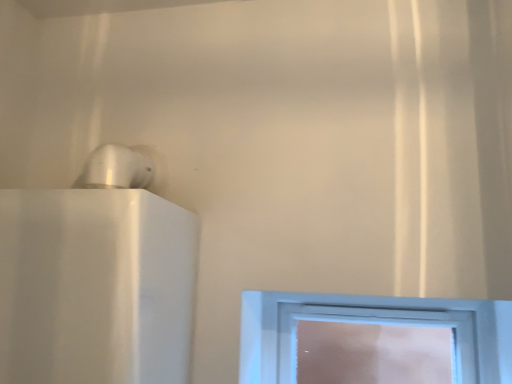
Question: From the image's perspective, is white glossy speaker at upper left located beneath clear glass window at center?

Choices:
 (A) no
 (B) yes

Answer: (A)

Question: Can you confirm if white glossy speaker at upper left is wider than clear glass window at center?

Choices:
 (A) yes
 (B) no

Answer: (A)

Question: Does white glossy speaker at upper left appear on the right side of clear glass window at center?

Choices:
 (A) no
 (B) yes

Answer: (A)

Question: Does white glossy speaker at upper left have a greater height compared to clear glass window at center?

Choices:
 (A) yes
 (B) no

Answer: (A)

Question: Does white glossy speaker at upper left lie in front of clear glass window at center?

Choices:
 (A) yes
 (B) no

Answer: (A)

Question: Considering the relative sizes of white glossy speaker at upper left and clear glass window at center in the image provided, is white glossy speaker at upper left smaller than clear glass window at center?

Choices:
 (A) yes
 (B) no

Answer: (B)

Question: Does clear glass window at center have a lesser height compared to white glossy speaker at upper left?

Choices:
 (A) yes
 (B) no

Answer: (A)

Question: Can you see clear glass window at center touching white glossy speaker at upper left?

Choices:
 (A) yes
 (B) no

Answer: (B)

Question: Does clear glass window at center turn towards white glossy speaker at upper left?

Choices:
 (A) yes
 (B) no

Answer: (B)

Question: Can you confirm if clear glass window at center is wider than white glossy speaker at upper left?

Choices:
 (A) yes
 (B) no

Answer: (B)

Question: From a real-world perspective, is clear glass window at center positioned over white glossy speaker at upper left based on gravity?

Choices:
 (A) no
 (B) yes

Answer: (A)

Question: From the image's perspective, is clear glass window at center under white glossy speaker at upper left?

Choices:
 (A) no
 (B) yes

Answer: (B)

Question: Does point (356, 307) appear closer or farther from the camera than point (44, 210)?

Choices:
 (A) closer
 (B) farther

Answer: (B)